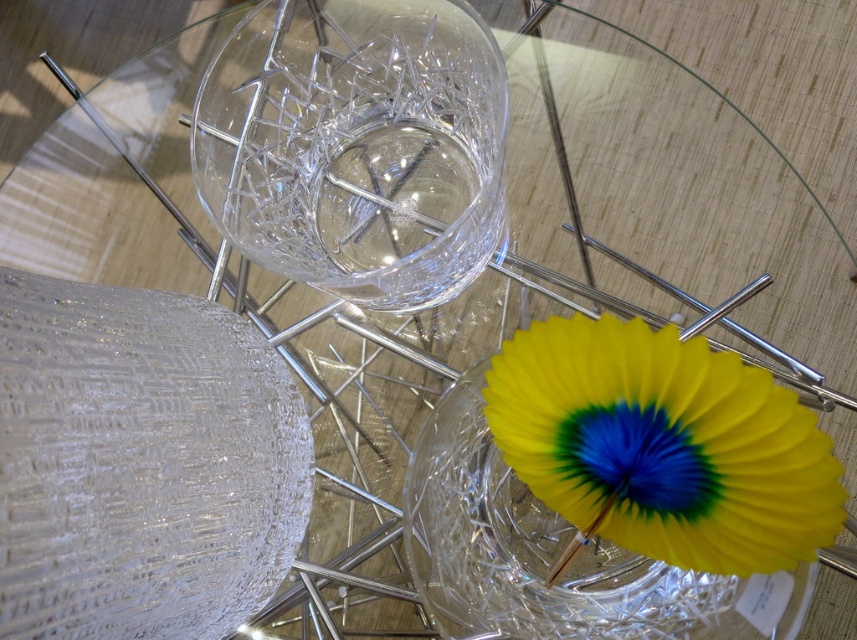
How far apart are transparent crystal vase at upper center and yellow paper fan at lower right?

transparent crystal vase at upper center and yellow paper fan at lower right are 3.70 inches apart.

Is point (339, 99) farther from viewer compared to point (843, 515)?

Yes.

Between point (481, 161) and point (681, 449), which one is positioned behind?

The point (481, 161) is more distant.

Find the location of a particular element. transparent crystal vase at upper center is located at coordinates (357, 145).